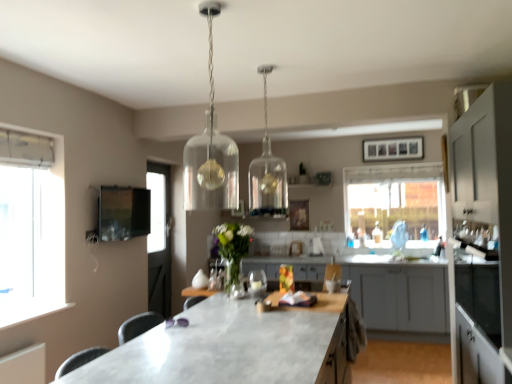
Locate an element on the screen. free space in front of translucent glass vase at center is located at coordinates (228, 302).